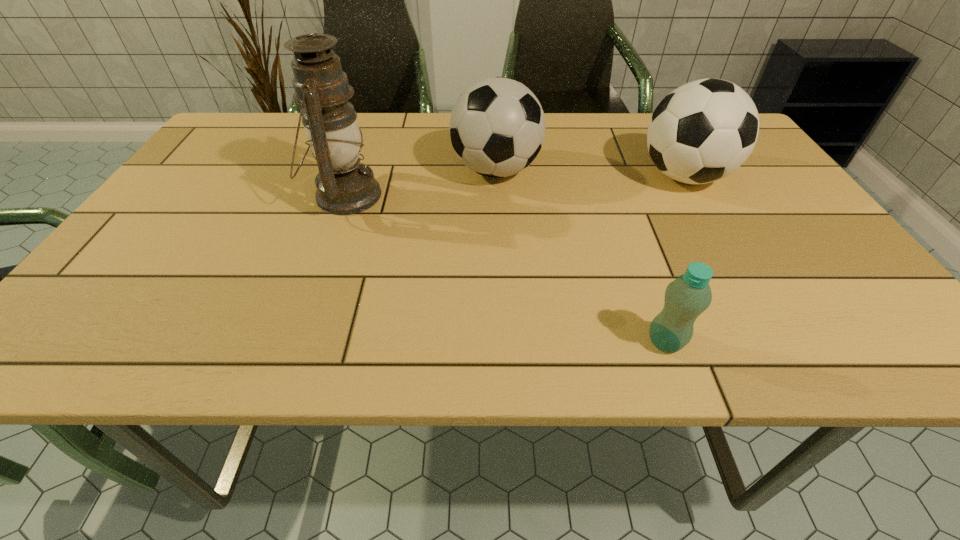
At what (x,y) coordinates should I click in order to perform the action: click on oil lamp. Please return your answer as a coordinate pair (x, y). Looking at the image, I should click on (345, 186).

Locate an element on the screen. Image resolution: width=960 pixels, height=540 pixels. the tallest object is located at coordinates (345, 186).

What are the coordinates of `the rightmost object` in the screenshot? It's located at (701, 132).

The image size is (960, 540). Find the location of `the left soccer ball`. the left soccer ball is located at coordinates (497, 126).

Find the location of a particular element. The height and width of the screenshot is (540, 960). water bottle is located at coordinates (689, 295).

Find the location of a particular element. Image resolution: width=960 pixels, height=540 pixels. the shortest object is located at coordinates (689, 295).

Where is `free space located on the left of the leftmost object`? The height and width of the screenshot is (540, 960). free space located on the left of the leftmost object is located at coordinates (228, 195).

Where is `free region located on the left of the right soccer ball`? This screenshot has height=540, width=960. free region located on the left of the right soccer ball is located at coordinates (564, 176).

Where is `vacant space positioned 0.330m on the right of the third object from right to left`? The image size is (960, 540). vacant space positioned 0.330m on the right of the third object from right to left is located at coordinates (672, 170).

Find the location of a particular element. The width and height of the screenshot is (960, 540). blank space located at the front cap of the water bottle is located at coordinates [450, 342].